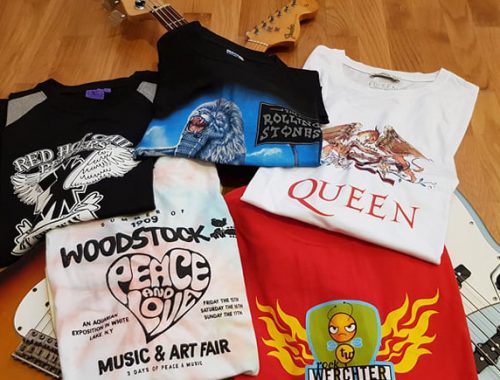
The width and height of the screenshot is (500, 380). Identify the location of table. (489, 133).